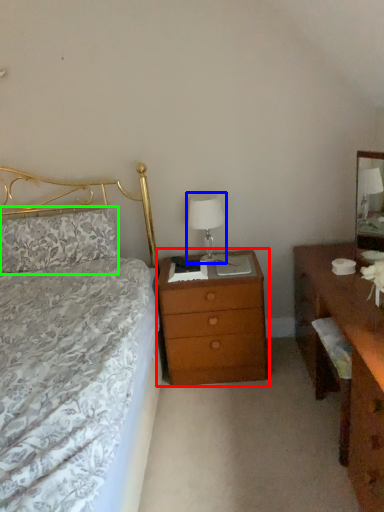
Question: Based on their relative distances, which object is farther from nightstand (highlighted by a red box)? Choose from bedside lamp (highlighted by a blue box) and pillow (highlighted by a green box).

Choices:
 (A) bedside lamp
 (B) pillow

Answer: (B)